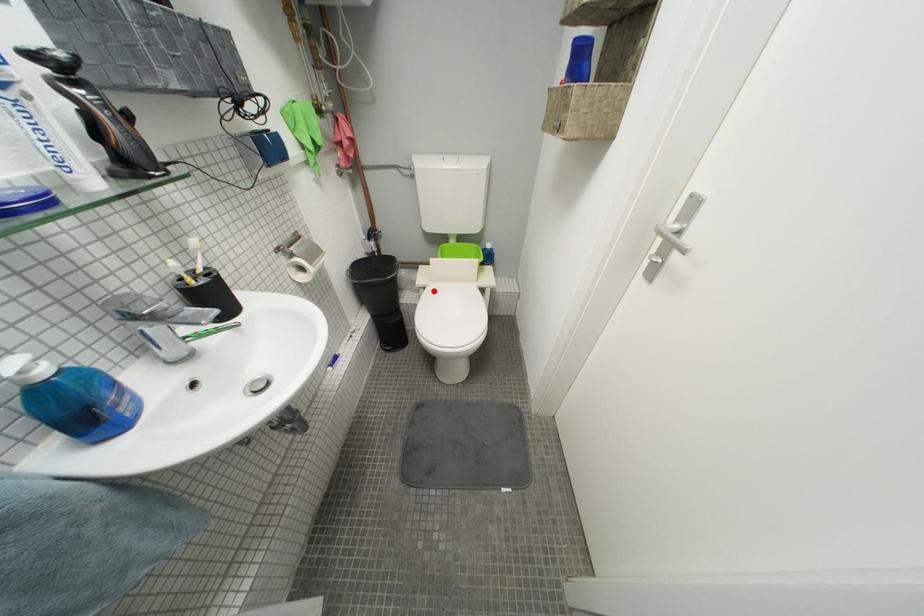
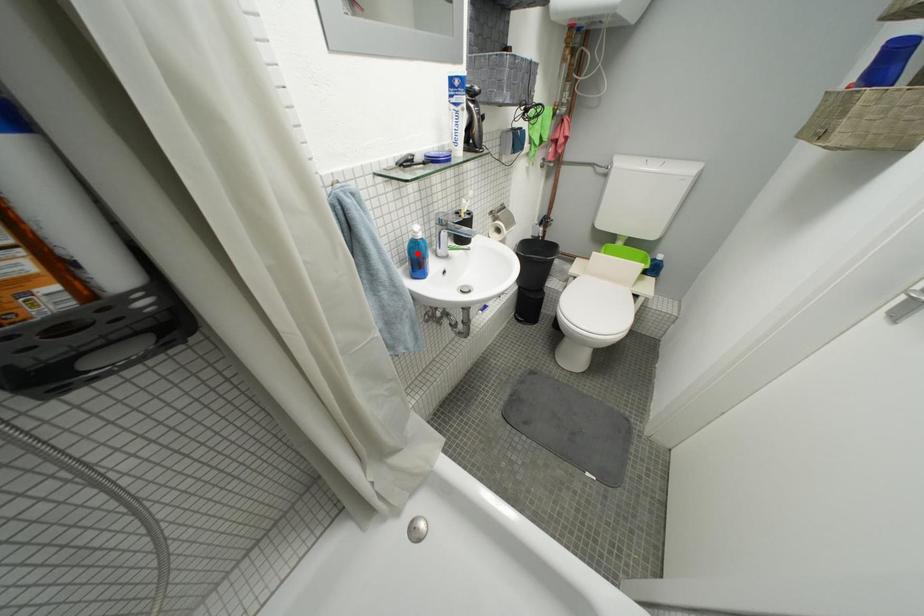
I am providing you with two images of the same scene from different viewpoints. A red point is marked on the first image and another point is marked on the second image. Does the point marked in image1 correspond to the same location as the one in image2?

No